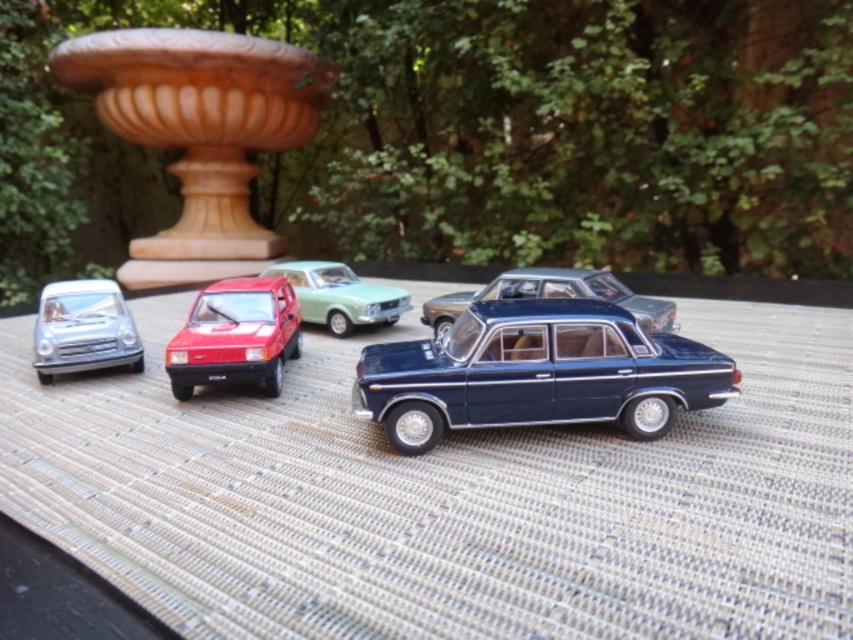
Question: Which point is farther to the camera?

Choices:
 (A) (469, 337)
 (B) (86, 355)

Answer: (B)

Question: Which of the following is the farthest from the observer?

Choices:
 (A) (344, 333)
 (B) (714, 378)

Answer: (A)

Question: Among these objects, which one is farthest from the camera?

Choices:
 (A) shiny blue sedan at center
 (B) shiny silver car at left
 (C) shiny red car at center
 (D) light green glossy car at center

Answer: (D)

Question: Where is shiny red car at center located in relation to shiny silver car at left in the image?

Choices:
 (A) left
 (B) right

Answer: (B)

Question: Is shiny blue sedan at center smaller than shiny silver car at left?

Choices:
 (A) yes
 (B) no

Answer: (B)

Question: From the image, what is the correct spatial relationship of shiny blue sedan at center in relation to shiny silver car at left?

Choices:
 (A) above
 (B) below

Answer: (B)